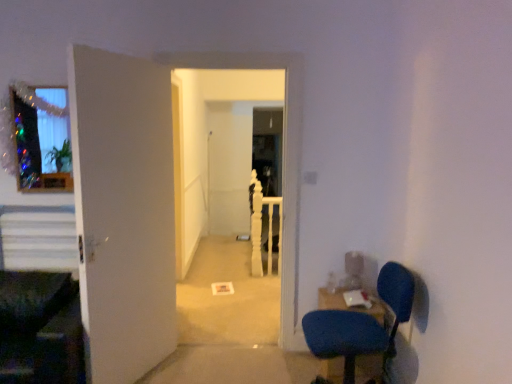
What do you see at coordinates (362, 325) in the screenshot? This screenshot has width=512, height=384. I see `blue fabric chair at lower right` at bounding box center [362, 325].

At what (x,y) coordinates should I click in order to perform the action: click on white wooden rail at center. Please return your answer as a coordinate pair (x, y). Looking at the image, I should click on (261, 228).

In order to face blue fabric table at lower right, should I rotate leftwards or rightwards?

A 12.540 degree turn to the right will do.

At what (x,y) coordinates should I click in order to perform the action: click on blue fabric table at lower right. Please return your answer as a coordinate pair (x, y). Looking at the image, I should click on (346, 305).

Consider the image. Measure the distance between translucent glass window at upper left and camera.

translucent glass window at upper left is 2.84 meters from camera.

The width and height of the screenshot is (512, 384). Describe the element at coordinates (219, 148) in the screenshot. I see `white matte carpet at center` at that location.

Locate an element on the screen. white matte carpet at center is located at coordinates (219, 148).

This screenshot has height=384, width=512. What do you see at coordinates (38, 238) in the screenshot? I see `white striped stairs at left` at bounding box center [38, 238].

Where is `white matte door at left`? white matte door at left is located at coordinates (123, 211).

Can you confirm if translucent glass window at upper left is positioned to the left of white matte carpet at center?

Yes, translucent glass window at upper left is to the left of white matte carpet at center.

Is translucent glass window at upper left further to the viewer compared to white matte carpet at center?

No, translucent glass window at upper left is closer to the camera.

Between translucent glass window at upper left and white matte carpet at center, which one has less height?

Standing shorter between the two is translucent glass window at upper left.

From the image's perspective, is white matte carpet at center positioned above or below white matte door at left?

white matte carpet at center is above white matte door at left.

Could you tell me if white matte carpet at center is facing white matte door at left?

No, white matte carpet at center is not facing towards white matte door at left.

Can you see white matte carpet at center touching white matte door at left?

No, white matte carpet at center is not beside white matte door at left.

From a real-world perspective, is white matte carpet at center positioned above or below white matte door at left?

white matte carpet at center is situated higher than white matte door at left in the real world.

Does blue fabric chair at lower right have a smaller size compared to white wooden rail at center?

Incorrect, blue fabric chair at lower right is not smaller in size than white wooden rail at center.

Considering the positions of objects blue fabric chair at lower right and white wooden rail at center in the image provided, who is in front, blue fabric chair at lower right or white wooden rail at center?

blue fabric chair at lower right.

From the picture: Are blue fabric chair at lower right and white wooden rail at center far apart?

That's right, there is a large distance between blue fabric chair at lower right and white wooden rail at center.

How many degrees apart are the facing directions of blue fabric chair at lower right and white wooden rail at center?

87.8 degrees separate the facing orientations of blue fabric chair at lower right and white wooden rail at center.

Considering the relative sizes of blue fabric chair at lower right and white striped stairs at left in the image provided, is blue fabric chair at lower right shorter than white striped stairs at left?

Incorrect, the height of blue fabric chair at lower right does not fall short of that of white striped stairs at left.

Can you confirm if blue fabric chair at lower right is positioned to the left of white striped stairs at left?

No.

Is blue fabric chair at lower right turned away from white striped stairs at left?

No, blue fabric chair at lower right is not facing away from white striped stairs at left.

Is white striped stairs at left thinner than translucent glass window at upper left?

No.

Considering the positions of objects white striped stairs at left and translucent glass window at upper left in the image provided, who is more to the right, white striped stairs at left or translucent glass window at upper left?

translucent glass window at upper left.

Between white striped stairs at left and translucent glass window at upper left, which one is positioned in front?

translucent glass window at upper left is closer to the camera.

Considering the relative sizes of white striped stairs at left and translucent glass window at upper left in the image provided, is white striped stairs at left shorter than translucent glass window at upper left?

Yes, white striped stairs at left is shorter than translucent glass window at upper left.

Is point (100, 132) positioned before point (19, 121)?

Yes, point (100, 132) is in front of point (19, 121).

The height and width of the screenshot is (384, 512). I want to click on glass window lying behind the white matte door at left, so click(40, 140).

Would you say white matte door at left contains translucent glass window at upper left?

That's incorrect, translucent glass window at upper left is not inside white matte door at left.

From the image's perspective, is white matte door at left located above or below translucent glass window at upper left?

white matte door at left is below translucent glass window at upper left.

Looking at this image, is blue fabric table at lower right positioned in front of white wooden rail at center?

Yes, blue fabric table at lower right is closer to the camera.

Can you confirm if blue fabric table at lower right is wider than white wooden rail at center?

Correct, the width of blue fabric table at lower right exceeds that of white wooden rail at center.

Considering the positions of objects blue fabric table at lower right and white wooden rail at center in the image provided, who is more to the left, blue fabric table at lower right or white wooden rail at center?

white wooden rail at center.

Where is `glass window above the white matte carpet at center (from the image's perspective)`? glass window above the white matte carpet at center (from the image's perspective) is located at coordinates (40, 140).

This screenshot has height=384, width=512. Find the location of `corridor behind the white matte door at left`. corridor behind the white matte door at left is located at coordinates (219, 148).

Estimate the real-world distances between objects in this image. Which object is closer to white wooden rail at center, white matte carpet at center or white matte door at left?

Among the two, white matte carpet at center is located nearer to white wooden rail at center.

From the image, which object appears to be nearer to white striped stairs at left, blue fabric table at lower right or white matte carpet at center?

blue fabric table at lower right.

Which object lies further to the anchor point white matte door at left, white striped stairs at left or white wooden rail at center?

white wooden rail at center is further to white matte door at left.

When comparing their distances from white matte carpet at center, does blue fabric table at lower right or translucent glass window at upper left seem closer?

Based on the image, translucent glass window at upper left appears to be nearer to white matte carpet at center.

Looking at this image, based on their spatial positions, is blue fabric chair at lower right or white matte carpet at center further from white wooden rail at center?

Based on the image, blue fabric chair at lower right appears to be further to white wooden rail at center.

Estimate the real-world distances between objects in this image. Which object is further from white matte door at left, white matte carpet at center or white striped stairs at left?

white matte carpet at center is positioned further to the anchor white matte door at left.

From the image, which object appears to be farther from white striped stairs at left, blue fabric chair at lower right or translucent glass window at upper left?

blue fabric chair at lower right.

Estimate the real-world distances between objects in this image. Which object is further from white matte carpet at center, white wooden rail at center or translucent glass window at upper left?

Based on the image, translucent glass window at upper left appears to be further to white matte carpet at center.

Locate an element on the screen. The width and height of the screenshot is (512, 384). stairs between white matte carpet at center and white wooden rail at center from front to back is located at coordinates (38, 238).

In order to click on chair located between white matte carpet at center and blue fabric table at lower right in the left-right direction in this screenshot , I will do `click(362, 325)`.

Where is `chair between white matte door at left and blue fabric table at lower right from left to right`? Image resolution: width=512 pixels, height=384 pixels. chair between white matte door at left and blue fabric table at lower right from left to right is located at coordinates (362, 325).

Identify the location of stairs positioned between white matte door at left and white wooden rail at center from near to far. (38, 238).